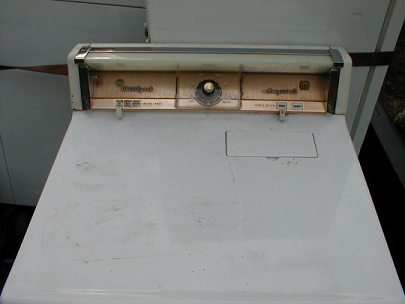
At what (x,y) coordinates should I click in order to perform the action: click on fridge. Please return your answer as a coordinate pair (x, y). Image resolution: width=405 pixels, height=304 pixels. Looking at the image, I should click on (366, 96).